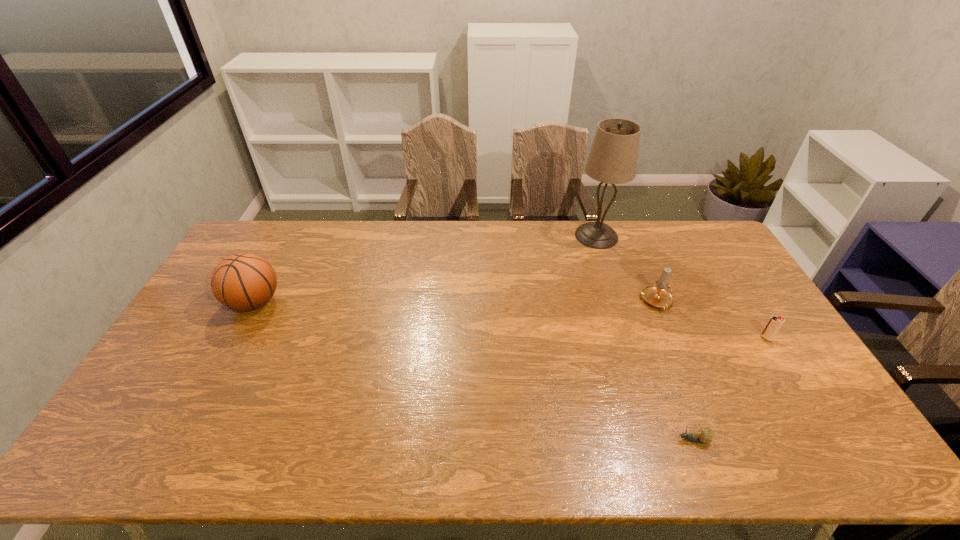
Where is `the farthest object`? Image resolution: width=960 pixels, height=540 pixels. the farthest object is located at coordinates point(613,156).

Where is `lampshade`? This screenshot has width=960, height=540. lampshade is located at coordinates (613, 156).

Locate an element on the screen. the second tallest object is located at coordinates (243, 282).

You are a GUI agent. You are given a task and a screenshot of the screen. Output one action in this format:
    pyautogui.click(x=<x>, y=<y>)
    Task: Click on the basketball
    Image resolution: width=960 pixels, height=540 pixels.
    Given the screenshot: What is the action you would take?
    pyautogui.click(x=243, y=282)

Identify the location of candle. Image resolution: width=960 pixels, height=540 pixels. (659, 295).

What are the coordinates of `igniter` in the screenshot? It's located at (774, 324).

The width and height of the screenshot is (960, 540). Find the location of `the second nearest object`. the second nearest object is located at coordinates (774, 324).

Image resolution: width=960 pixels, height=540 pixels. In order to click on the shortest object in this screenshot , I will do `click(705, 435)`.

At what (x,y) coordinates should I click in order to perform the action: click on the nearest object. Please return your answer as a coordinate pair (x, y). The height and width of the screenshot is (540, 960). Looking at the image, I should click on (705, 435).

The height and width of the screenshot is (540, 960). Find the location of `vacant space located 0.140m on the front-facing side of the lampshade`. vacant space located 0.140m on the front-facing side of the lampshade is located at coordinates (610, 275).